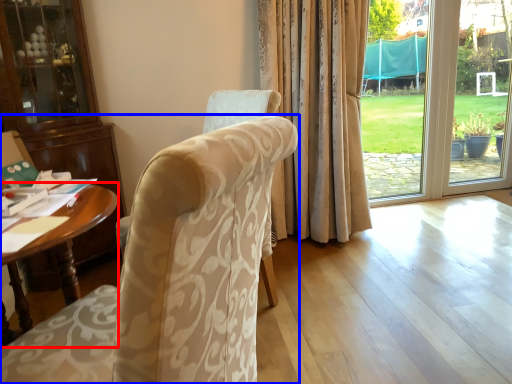
Question: Which object appears farthest to the camera in this image, desk (highlighted by a red box) or chair (highlighted by a blue box)?

Choices:
 (A) desk
 (B) chair

Answer: (A)